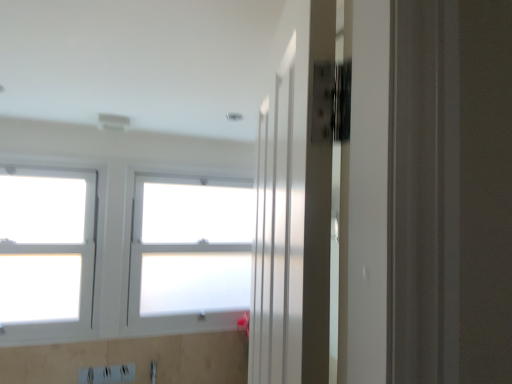
Question: Which direction should I rotate to look at white frosted glass window at center, which is counted as the second window, starting from the left?

Choices:
 (A) left
 (B) right

Answer: (A)

Question: Is white frosted glass window at center, the first window viewed from the right, at the back of white glass window at left, the first window in the left-to-right sequence?

Choices:
 (A) no
 (B) yes

Answer: (A)

Question: Can you confirm if white glass window at left, the second window from the right, is positioned to the right of white frosted glass window at center, which is counted as the second window, starting from the left?

Choices:
 (A) no
 (B) yes

Answer: (A)

Question: From the image's perspective, is white glass window at left, the second window from the right, over white frosted glass window at center, the first window viewed from the right?

Choices:
 (A) yes
 (B) no

Answer: (A)

Question: From a real-world perspective, is white glass window at left, the second window from the right, on top of white frosted glass window at center, which is counted as the second window, starting from the left?

Choices:
 (A) yes
 (B) no

Answer: (A)

Question: Is the depth of white glass window at left, the first window in the left-to-right sequence, less than that of white frosted glass window at center, which is counted as the second window, starting from the left?

Choices:
 (A) no
 (B) yes

Answer: (B)

Question: From the image's perspective, would you say white glass window at left, the second window from the right, is shown under white frosted glass window at center, which is counted as the second window, starting from the left?

Choices:
 (A) no
 (B) yes

Answer: (A)

Question: From a real-world perspective, is white frosted glass window at center, the first window viewed from the right, positioned over white glass window at left, the second window from the right, based on gravity?

Choices:
 (A) no
 (B) yes

Answer: (A)

Question: Does white frosted glass window at center, the first window viewed from the right, have a lesser height compared to white glass window at left, the first window in the left-to-right sequence?

Choices:
 (A) yes
 (B) no

Answer: (A)

Question: From the image's perspective, is white frosted glass window at center, the first window viewed from the right, beneath white glass window at left, the first window in the left-to-right sequence?

Choices:
 (A) yes
 (B) no

Answer: (A)

Question: Is white glass window at left, the first window in the left-to-right sequence, completely or partially inside white frosted glass window at center, which is counted as the second window, starting from the left?

Choices:
 (A) yes
 (B) no

Answer: (B)

Question: Can you confirm if white frosted glass window at center, the first window viewed from the right, is positioned to the right of white glass window at left, the first window in the left-to-right sequence?

Choices:
 (A) yes
 (B) no

Answer: (A)

Question: From a real-world perspective, is white frosted glass window at center, which is counted as the second window, starting from the left, positioned under white glass window at left, the first window in the left-to-right sequence, based on gravity?

Choices:
 (A) no
 (B) yes

Answer: (B)

Question: From a real-world perspective, relative to white glass window at left, the second window from the right, is white frosted glass window at center, which is counted as the second window, starting from the left, vertically above or below?

Choices:
 (A) above
 (B) below

Answer: (B)